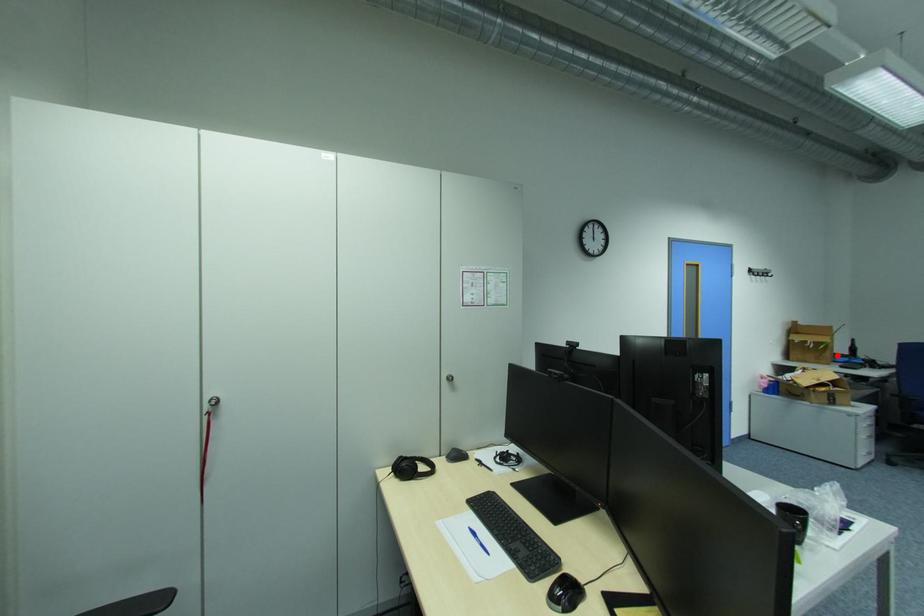
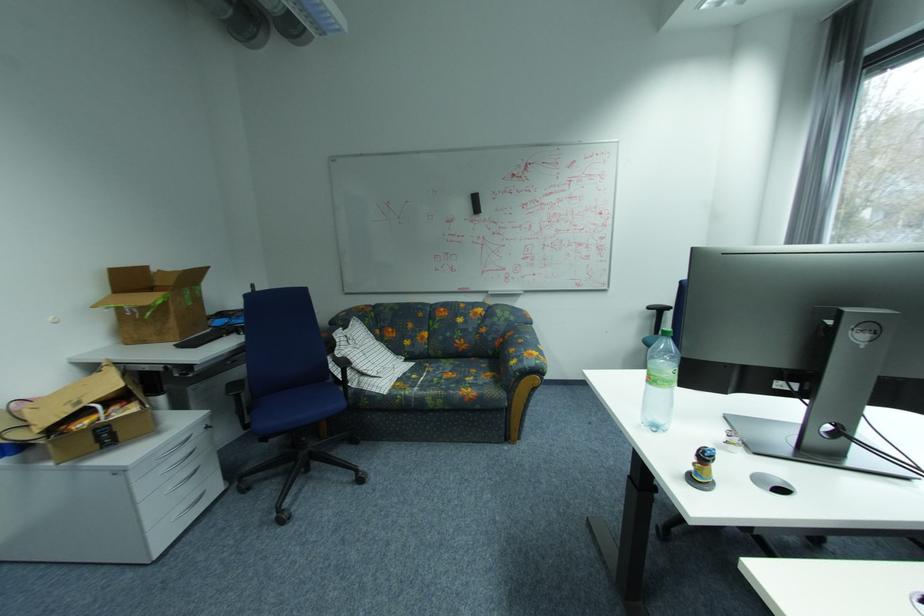
Locate, in the second image, the point that corresponds to the highlighted location in the first image.

(180, 323)